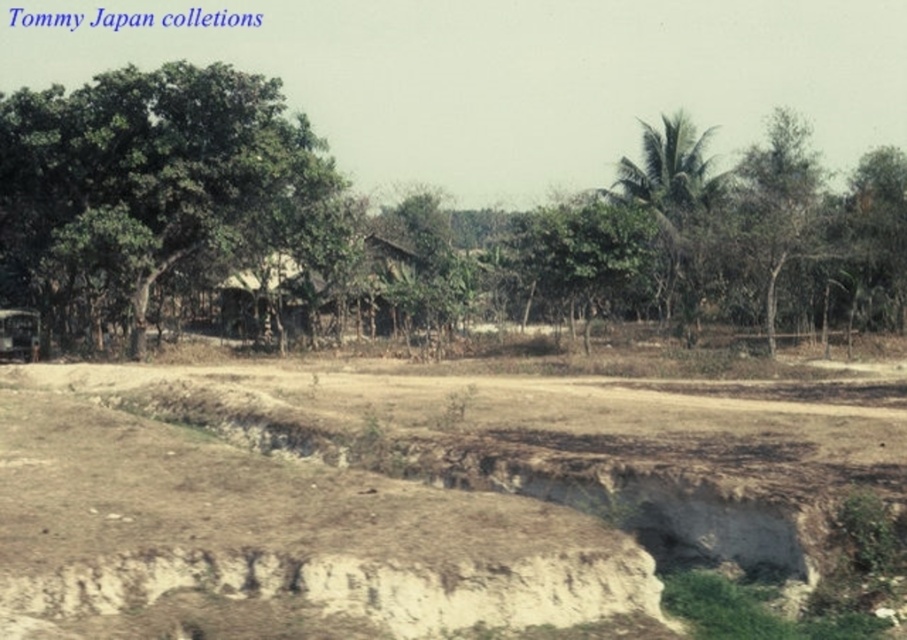
You are standing at the center of the dirt path in the rural landscape. Looking around, you see the brown sandy dirt field at center marked by point (401, 499). Which direction should you walk to reach the cluster of traditional huts or houses in the midground?

The cluster of traditional huts or houses is in the midground, which is closer to the viewer than the background. Since the brown sandy dirt field at center is marked by point (401, 499), you should walk away from this point towards the midground to reach the cluster of traditional huts or houses.

You are standing at the origin point of the image coordinate system. You want to walk to the brown sandy dirt field at center. Which direction should you go?

The brown sandy dirt field at center is located at coordinate point (x=401, y=499), so you should move towards the right and slightly upwards from your current position at the origin.

You are standing at the center of the dirt path in the rural landscape. You see a point marked at coordinates (158,173). What object is located at that point?

The point at coordinates (158,173) indicates a green leafy tree at left.